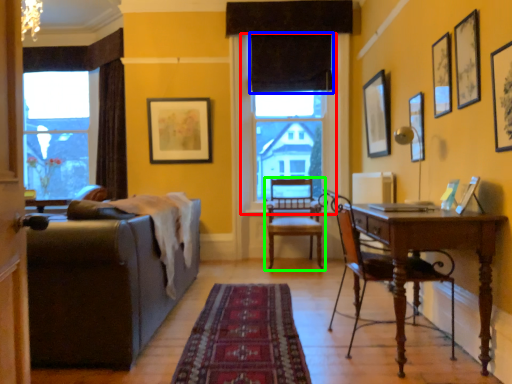
Question: Which is farther away from window screen (highlighted by a red box)? curtain (highlighted by a blue box) or chair (highlighted by a green box)?

Choices:
 (A) curtain
 (B) chair

Answer: (B)